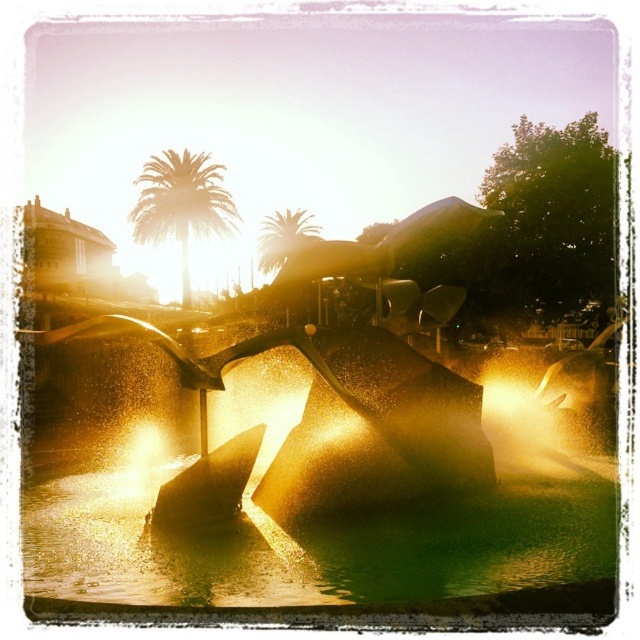
Question: Is green leafy palm tree at upper left in front of green leafy palm tree at upper center?

Choices:
 (A) yes
 (B) no

Answer: (B)

Question: Which point appears farthest from the camera in this image?

Choices:
 (A) (225, 196)
 (B) (296, 248)

Answer: (B)

Question: Can you confirm if green leafy palm tree at upper left is wider than green leafy palm tree at upper center?

Choices:
 (A) no
 (B) yes

Answer: (B)

Question: Does green leafy palm tree at upper left have a lesser width compared to green leafy palm tree at upper center?

Choices:
 (A) yes
 (B) no

Answer: (B)